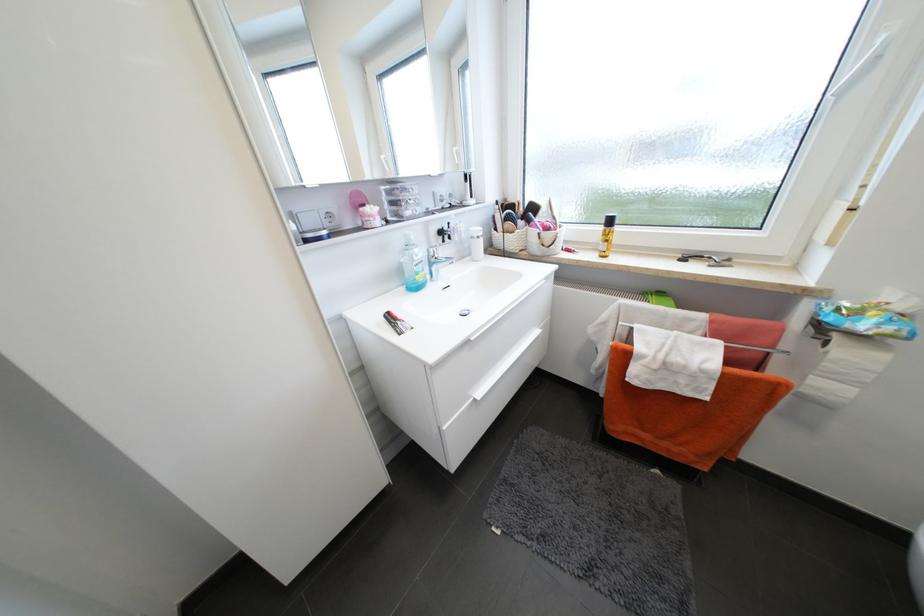
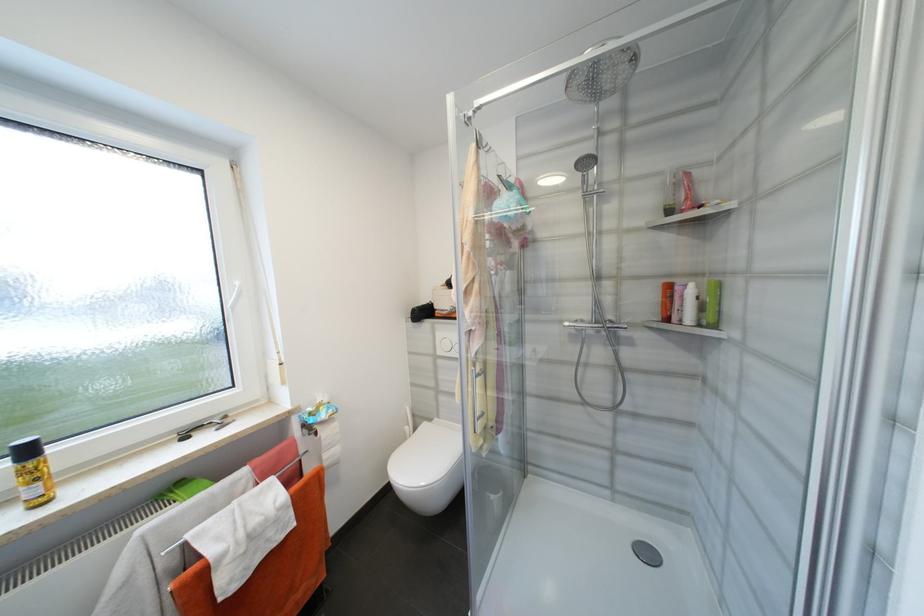
In the second image, find the point that corresponds to point (615, 223) in the first image.

(33, 453)